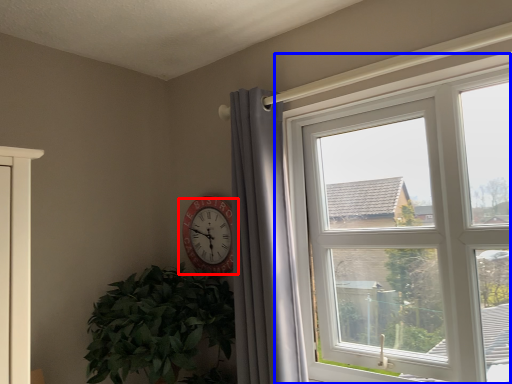
Question: Which point is closer to the camera, wall clock (highlighted by a red box) or window (highlighted by a blue box)?

Choices:
 (A) wall clock
 (B) window

Answer: (B)